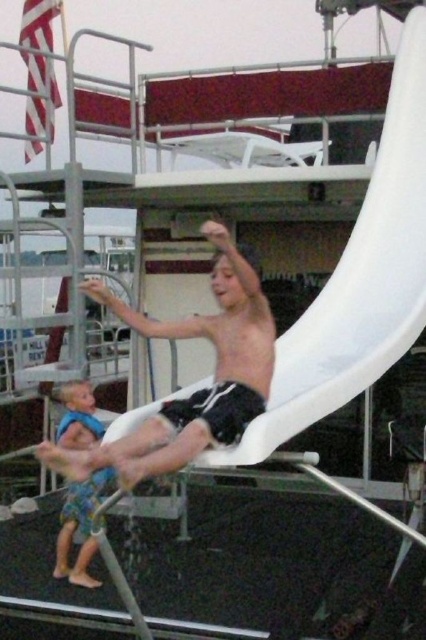
You are at a water park and want to choose between the white plastic slide at center and the smooth white slide at center. Which one is wider?

The white plastic slide at center is wider than the smooth white slide at center according to the description.

Consider the image. You are a parent at the water park and want to ensure your child can safely reach the top of the smooth white slide at center. Considering the height of the blue fabric swimsuit at lower left, can you estimate if the slide is within a safe climbing height for a child?

The smooth white slide at center is taller than the blue fabric swimsuit at lower left. Since the blue fabric swimsuit at lower left is worn by a child, the slide is likely taller than the child, which may pose a climbing challenge. Ensure the child uses proper safety measures or assistance when climbing.

You are a lifeguard at the water park. You need to ensure that the smooth white slide at center is wide enough for two children to slide down side by side. Given that the blue fabric swimsuit at lower left is 40 cm wide, can the slide accommodate two children?

The smooth white slide at center is wider than the blue fabric swimsuit at lower left, which is 40 cm wide. Since the slide is wider than 40 cm, it can accommodate two children sliding down side by side.